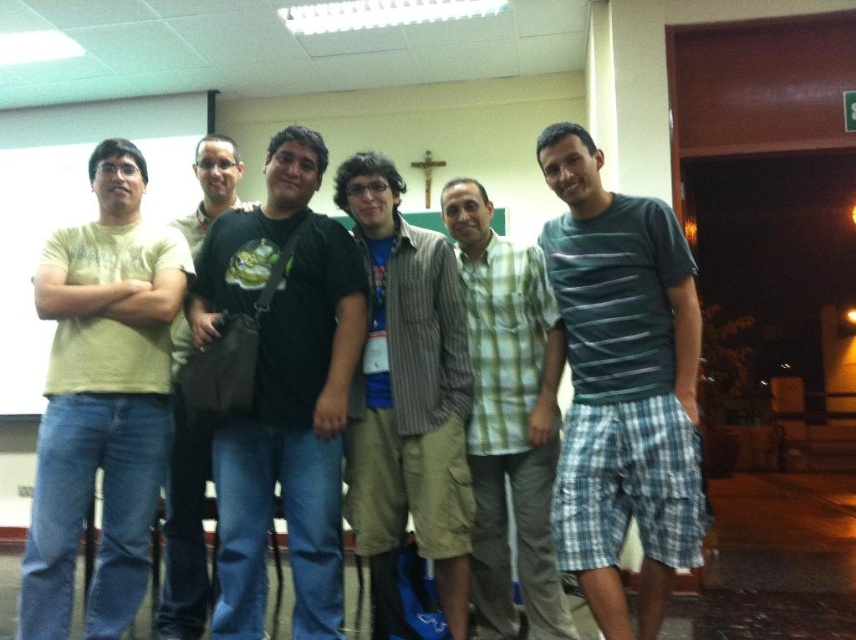
You are standing in the hallway and see two people wearing cotton shirts. One has a striped cotton shirt at center and the other has a black cotton shirt at left. Which one is positioned to the right of the other?

The striped cotton shirt at center is to the right of the black cotton shirt at left.

You are standing at point (x=321, y=262) and want to walk to point (x=563, y=128). Is there a clear path between these two points?

Point (x=563, y=128) is in front of point (x=321, y=262), so there is a clear path between them.